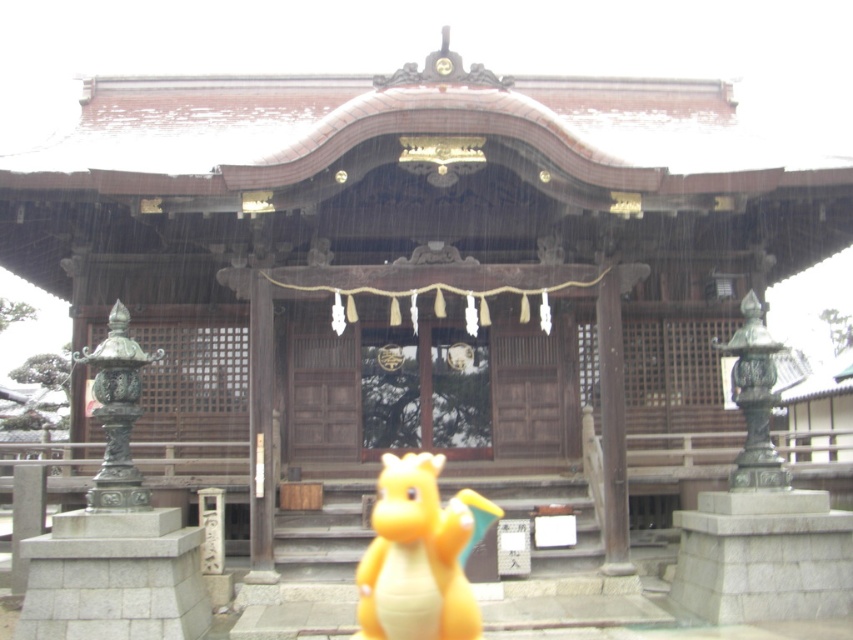
Does yellow matte toy dragon at center appear under bronze statue at left?

Yes.

Is yellow matte toy dragon at center further to camera compared to bronze statue at left?

No, yellow matte toy dragon at center is in front of bronze statue at left.

Between point (451, 588) and point (122, 420), which one is positioned behind?

The point (122, 420) is more distant.

Locate an element on the screen. Image resolution: width=853 pixels, height=640 pixels. yellow matte toy dragon at center is located at coordinates point(419,556).